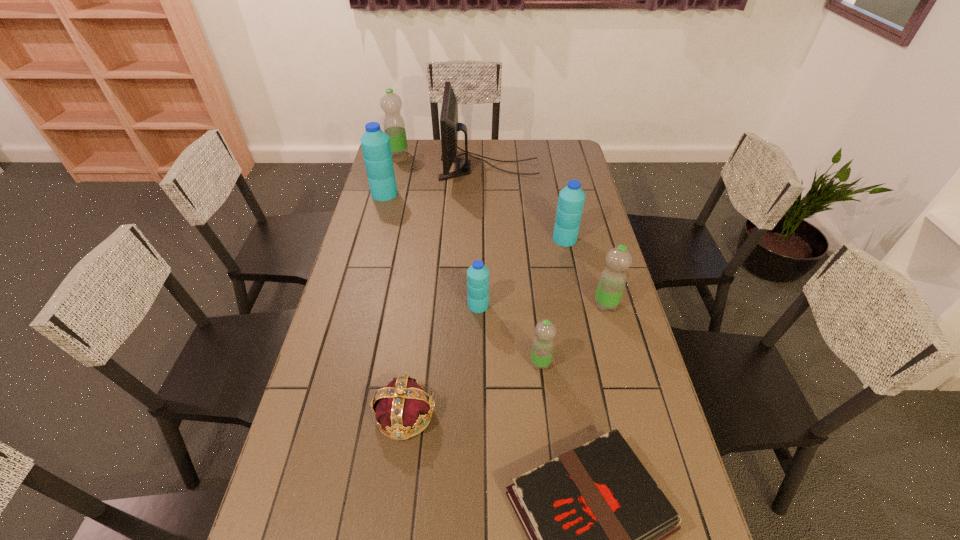
Identify the location of blank area located 0.110m on the left of the second farthest blue water bottle. (523, 239).

This screenshot has height=540, width=960. Find the location of `vacant space located on the back of the rightmost green water bottle`. vacant space located on the back of the rightmost green water bottle is located at coordinates (596, 270).

Identify the location of vacant area situated on the back of the nearest green water bottle. (531, 280).

Identify the location of blank space located 0.310m on the back of the second blue water bottle from right to left. Image resolution: width=960 pixels, height=540 pixels. (478, 235).

I want to click on vacant point located 0.070m on the left of the crown, so click(346, 414).

This screenshot has height=540, width=960. Identify the location of computer monitor that is at the far edge. coord(449,126).

Image resolution: width=960 pixels, height=540 pixels. Identify the location of water bottle that is at the far edge. (394, 126).

I want to click on object situated at the far left corner, so (x=394, y=126).

What are the coordinates of `blank area at the far edge` in the screenshot? It's located at (528, 149).

Find the location of a particular element. This screenshot has height=540, width=960. free region at the left edge of the desktop is located at coordinates (346, 343).